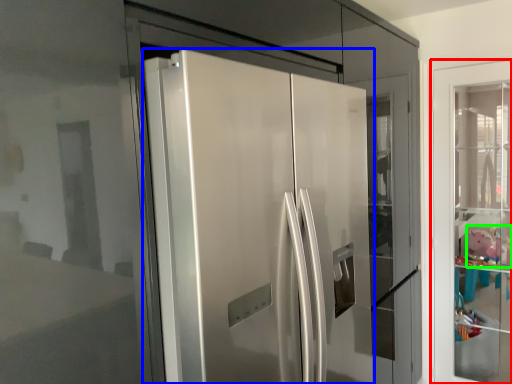
Question: Based on their relative distances, which object is nearer to door (highlighted by a red box)? Choose from door (highlighted by a blue box) and toy (highlighted by a green box).

Choices:
 (A) door
 (B) toy

Answer: (A)